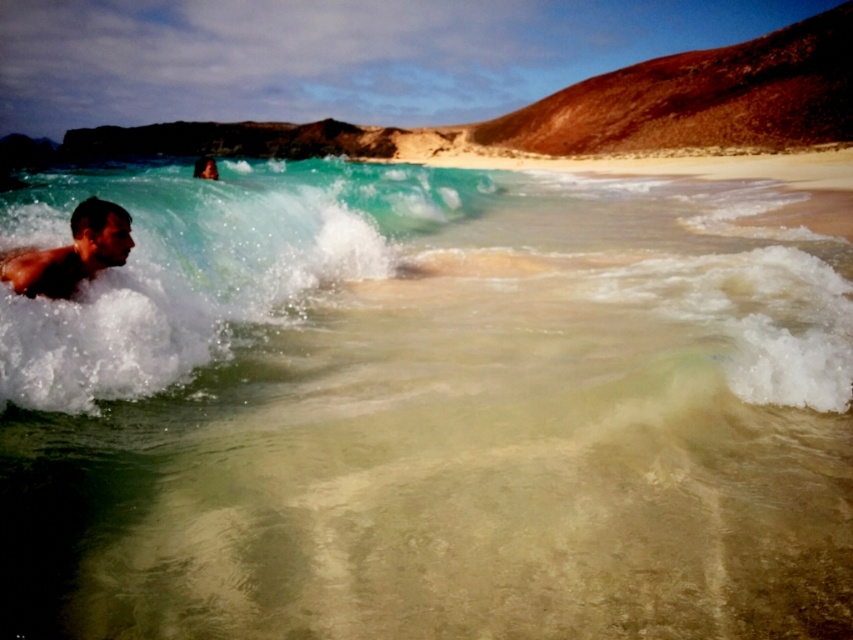
Question: From the image, what is the correct spatial relationship of translucent white water at left in relation to smooth skin man at left?

Choices:
 (A) above
 (B) below

Answer: (A)

Question: Considering the relative positions of translucent white water at left and smooth skin man at left in the image provided, where is translucent white water at left located with respect to smooth skin man at left?

Choices:
 (A) above
 (B) below

Answer: (A)

Question: Based on their relative distances, which object is nearer to the translucent white water at left?

Choices:
 (A) smooth skin man at left
 (B) smooth skin surfer at upper left

Answer: (A)

Question: Which point appears closest to the camera in this image?

Choices:
 (A) (241, 198)
 (B) (200, 157)
 (C) (100, 250)

Answer: (C)

Question: Which of these objects is positioned farthest from the translucent white water at left?

Choices:
 (A) smooth skin man at left
 (B) smooth skin surfer at upper left

Answer: (B)

Question: Can you confirm if translucent white water at left is thinner than smooth skin surfer at upper left?

Choices:
 (A) yes
 (B) no

Answer: (B)